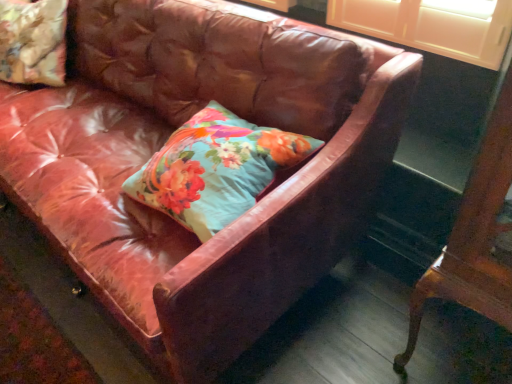
Question: Is floral fabric pillow at center, the second pillow viewed from the left, in contact with mahogany wood table at right?

Choices:
 (A) yes
 (B) no

Answer: (B)

Question: Considering the relative positions of floral fabric pillow at center, the 1th pillow viewed from the right, and mahogany wood table at right in the image provided, is floral fabric pillow at center, the 1th pillow viewed from the right, to the left of mahogany wood table at right from the viewer's perspective?

Choices:
 (A) no
 (B) yes

Answer: (B)

Question: From a real-world perspective, is floral fabric pillow at center, the second pillow viewed from the left, on top of mahogany wood table at right?

Choices:
 (A) no
 (B) yes

Answer: (B)

Question: Is mahogany wood table at right inside floral fabric pillow at center, the second pillow viewed from the left?

Choices:
 (A) yes
 (B) no

Answer: (B)

Question: Can you confirm if floral fabric pillow at center, the second pillow viewed from the left, is wider than mahogany wood table at right?

Choices:
 (A) yes
 (B) no

Answer: (A)

Question: Considering the positions of floral fabric pillow at center, the second pillow viewed from the left, and mahogany wood table at right in the image, is floral fabric pillow at center, the second pillow viewed from the left, bigger or smaller than mahogany wood table at right?

Choices:
 (A) small
 (B) big

Answer: (A)

Question: Is floral fabric pillow at center, the 2th pillow positioned from the top, situated inside mahogany wood table at right or outside?

Choices:
 (A) outside
 (B) inside

Answer: (A)

Question: Is floral fabric pillow at center, acting as the first pillow starting from the front, in front of or behind mahogany wood table at right in the image?

Choices:
 (A) behind
 (B) front

Answer: (A)

Question: In terms of height, does floral fabric pillow at center, the second pillow viewed from the left, look taller or shorter compared to mahogany wood table at right?

Choices:
 (A) tall
 (B) short

Answer: (B)

Question: Looking at their shapes, would you say floral fabric cushion at upper left, which appears as the second pillow when viewed from the front, is wider or thinner than floral fabric pillow at center, the 2th pillow positioned from the top?

Choices:
 (A) wide
 (B) thin

Answer: (B)

Question: Would you say floral fabric cushion at upper left, which appears as the second pillow when viewed from the front, is inside or outside floral fabric pillow at center, the second pillow from the back?

Choices:
 (A) inside
 (B) outside

Answer: (B)

Question: From a real-world perspective, is floral fabric cushion at upper left, which appears as the first pillow when viewed from the top, above or below floral fabric pillow at center, the 1th pillow viewed from the right?

Choices:
 (A) below
 (B) above

Answer: (B)

Question: In terms of size, does floral fabric cushion at upper left, which appears as the first pillow when viewed from the top, appear bigger or smaller than floral fabric pillow at center, the 1th pillow viewed from the right?

Choices:
 (A) small
 (B) big

Answer: (B)

Question: From the image's perspective, relative to floral fabric cushion at upper left, which appears as the second pillow when viewed from the front, is floral fabric pillow at center, the second pillow from the back, above or below?

Choices:
 (A) below
 (B) above

Answer: (A)

Question: Is floral fabric pillow at center, acting as the first pillow starting from the front, in front of or behind floral fabric cushion at upper left, which appears as the first pillow when viewed from the top, in the image?

Choices:
 (A) front
 (B) behind

Answer: (A)